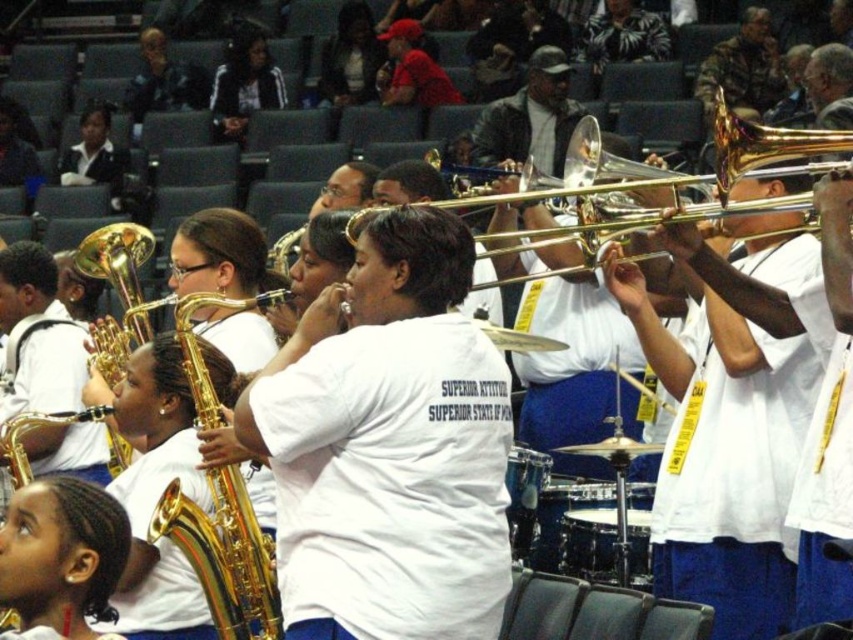
Question: Among these objects, which one is farthest from the camera?

Choices:
 (A) gold brass trumpet at center
 (B) black jacket at upper left
 (C) white matte shirt at center

Answer: (B)

Question: Is white matte shirt at center thinner than black jacket at upper left?

Choices:
 (A) yes
 (B) no

Answer: (B)

Question: Does gold shiny saxophone at center lie in front of black jacket at upper left?

Choices:
 (A) no
 (B) yes

Answer: (B)

Question: Which is farther from the black jacket at upper left?

Choices:
 (A) white matte shirt at center
 (B) gold brass trumpet at center
 (C) smooth gold saxophone at lower left

Answer: (C)

Question: Is gold shiny trumpet at upper right further to the viewer compared to white matte saxophone at center?

Choices:
 (A) yes
 (B) no

Answer: (B)

Question: Which point appears farthest from the camera in this image?

Choices:
 (A) (54, 417)
 (B) (97, 577)

Answer: (A)